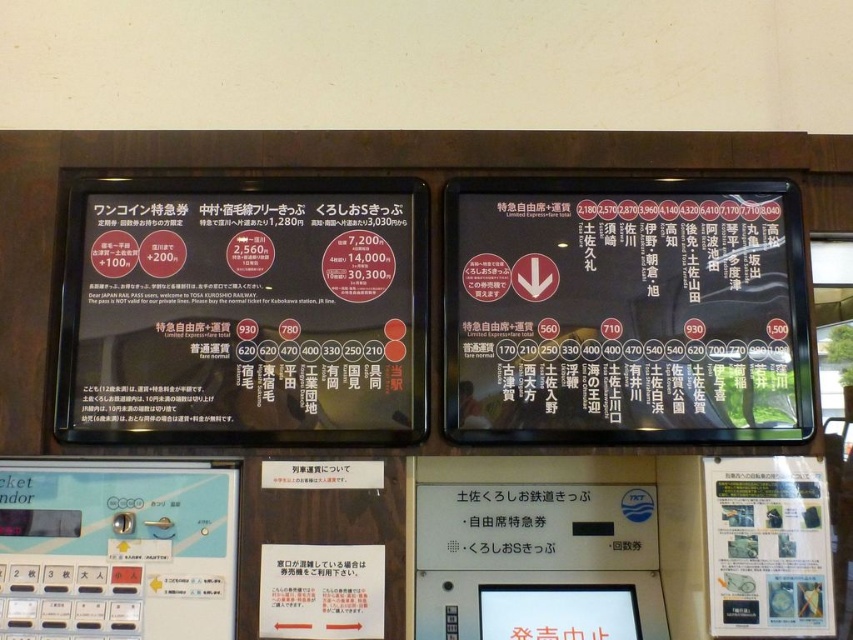
You are standing at the train station ticketing area and want to touch the display board at point (169, 257). Can you reach it without moving your position?

The point (169, 257) is 1.35 meters from the camera, so yes, you can reach it without moving your position if your arm can extend that far.

You are a traveler at the train station and need to choose between two signs to get fare information. The black matte sign at upper right and the clear plastic sign at lower right. Which one is bigger?

The black matte sign at upper right is larger in size than the clear plastic sign at lower right, so the black matte sign at upper right is bigger.